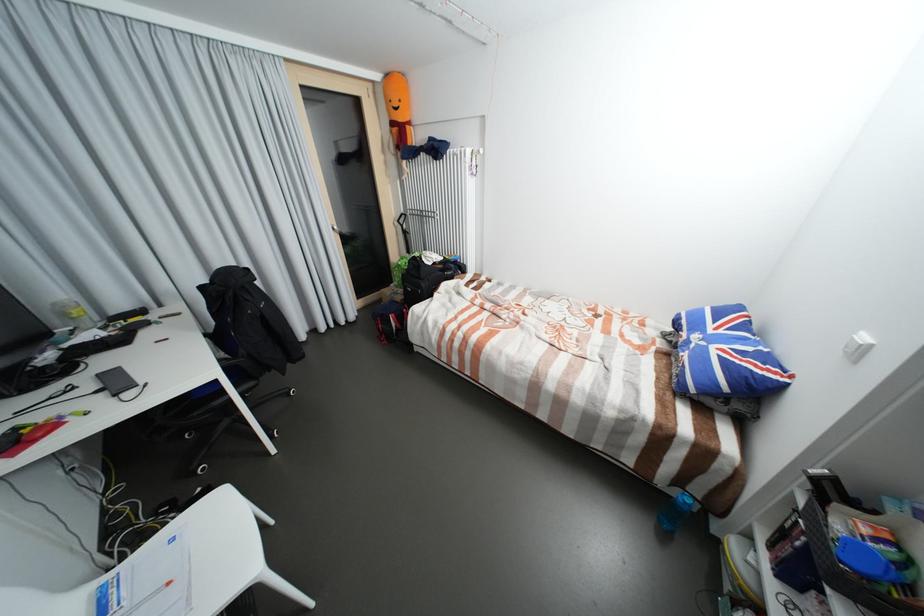
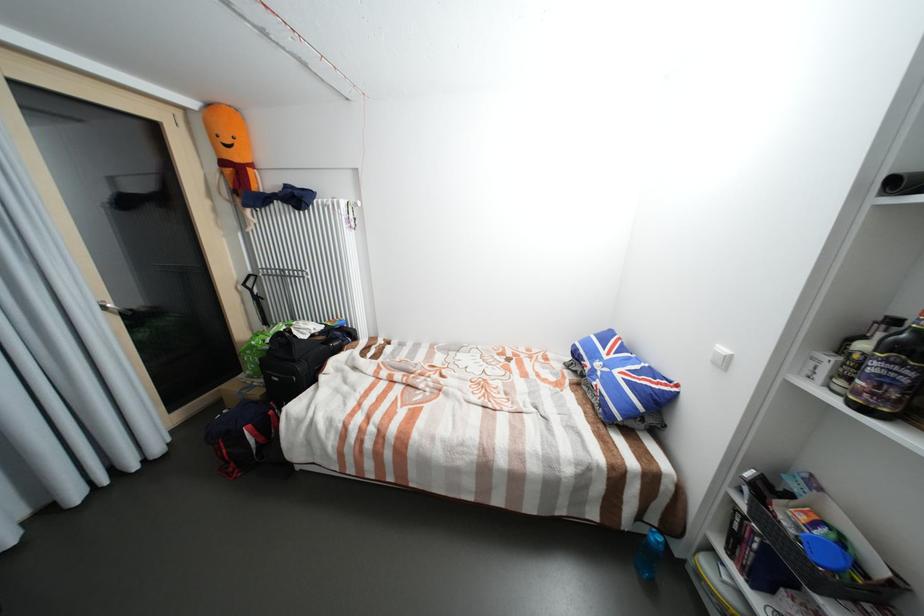
Find the pixel in the second image that matches point (341, 229) in the first image.

(112, 308)